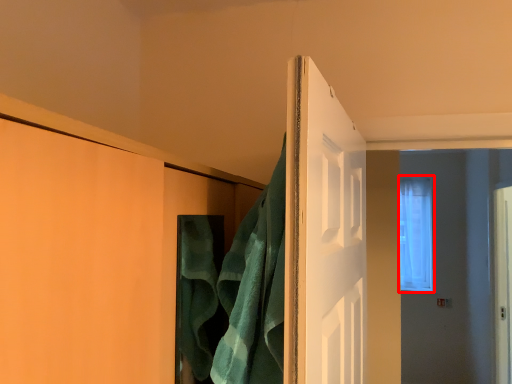
Question: From the image's perspective, what is the correct spatial relationship of window (annotated by the red box) in relation to bath towel?

Choices:
 (A) below
 (B) above

Answer: (A)